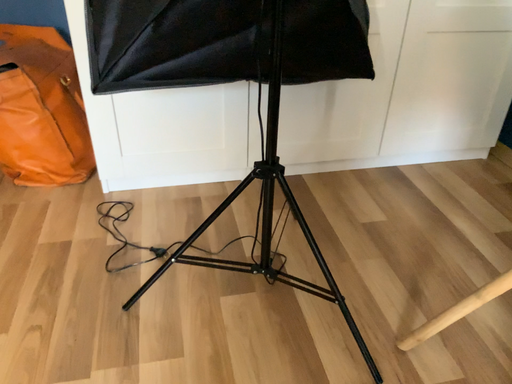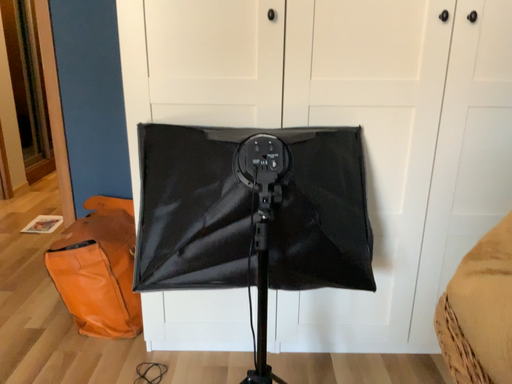
Question: How did the camera likely rotate when shooting the video?

Choices:
 (A) rotated left
 (B) rotated right

Answer: (A)